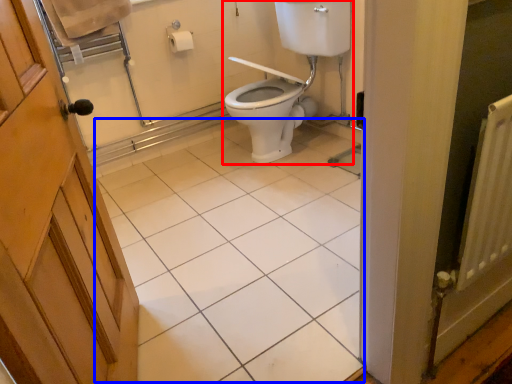
Question: Which point is further to the camera, sink (highlighted by a red box) or tile (highlighted by a blue box)?

Choices:
 (A) sink
 (B) tile

Answer: (A)